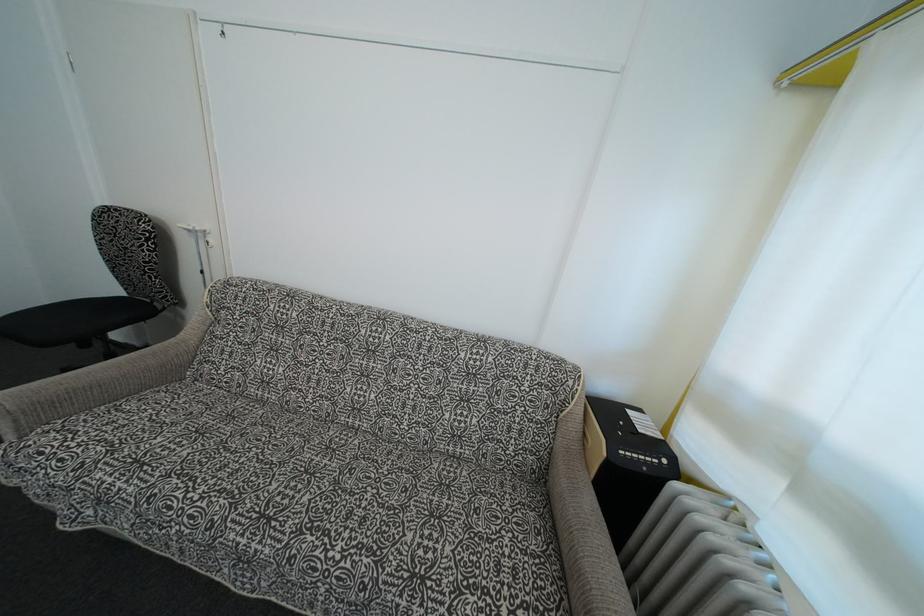
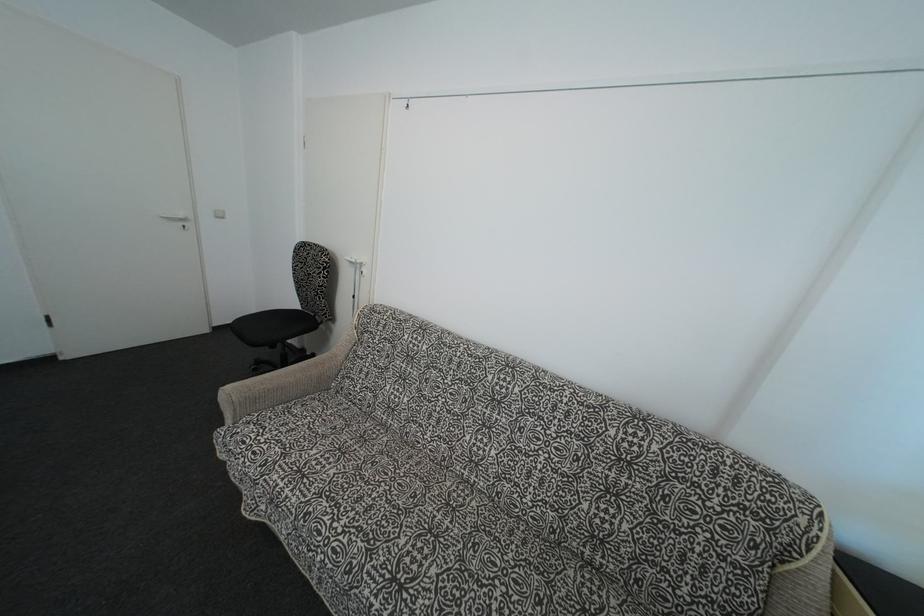
Question: The camera is either moving clockwise (left) or counter-clockwise (right) around the object. The first image is from the beginning of the video and the second image is from the end. Is the camera moving left or right when shooting the video?

Choices:
 (A) Left
 (B) Right

Answer: (B)